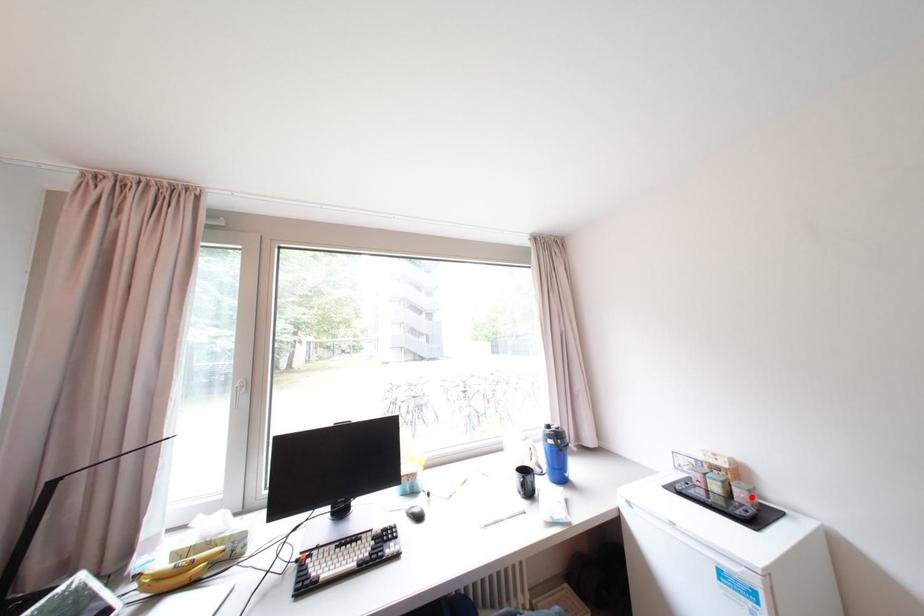
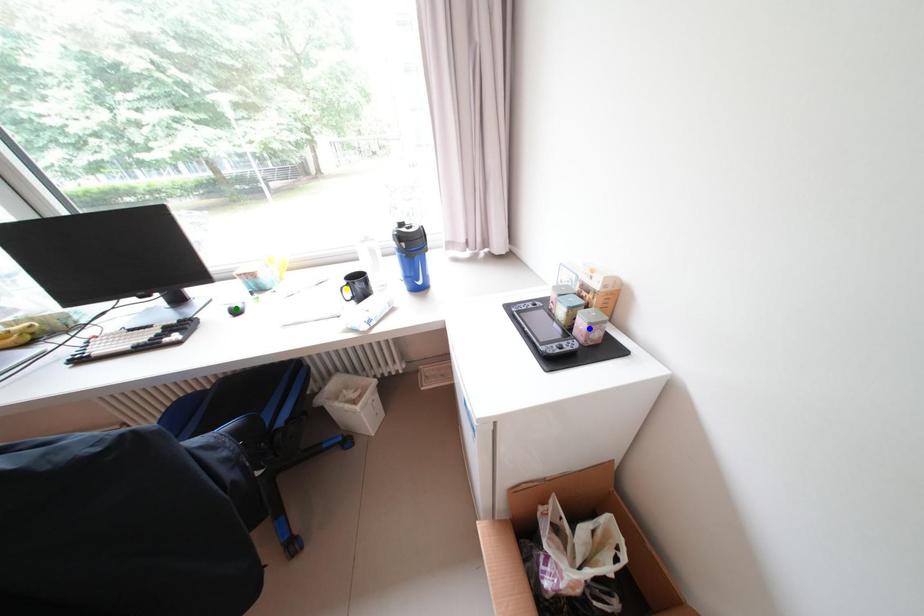
Question: I am providing you with two images of the same scene from different viewpoints. A red point is marked on the first image. You are given multiple points on the second image. Which spot in image 2 lines up with the point in image 1?

Choices:
 (A) yellow point
 (B) green point
 (C) blue point

Answer: (C)